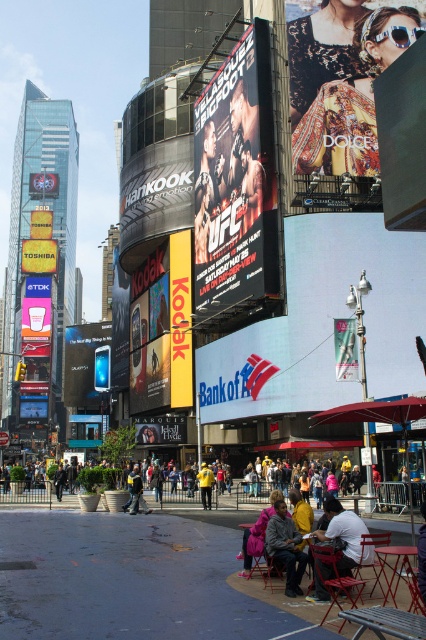
Question: Based on their relative distances, which object is nearer to the metallic silver sign at center?

Choices:
 (A) matte black phone at center
 (B) matte black billboard at center
 (C) yellow plastic billboard at center
 (D) white cotton shirt at lower right

Answer: (D)

Question: Considering the relative positions of metallic silver ufc poster at center and yellow plastic billboard at center in the image provided, where is metallic silver ufc poster at center located with respect to yellow plastic billboard at center?

Choices:
 (A) above
 (B) below

Answer: (B)

Question: Does matte black billboard at center have a smaller size compared to yellow fabric shirt at center?

Choices:
 (A) yes
 (B) no

Answer: (B)

Question: Which object is positioned farthest from the yellow cardboard kodak sign at center?

Choices:
 (A) yellow plastic billboard at center
 (B) patterned fabric scarf at upper right
 (C) yellow fabric shirt at center

Answer: (A)

Question: Which object appears closest to the camera in this image?

Choices:
 (A) matte black billboard at center
 (B) pink fabric jacket at lower center
 (C) yellow plastic billboard at center
 (D) yellow fabric shirt at center

Answer: (B)

Question: Is metallic silver ufc poster at center to the left of yellow fabric shirt at center from the viewer's perspective?

Choices:
 (A) no
 (B) yes

Answer: (A)